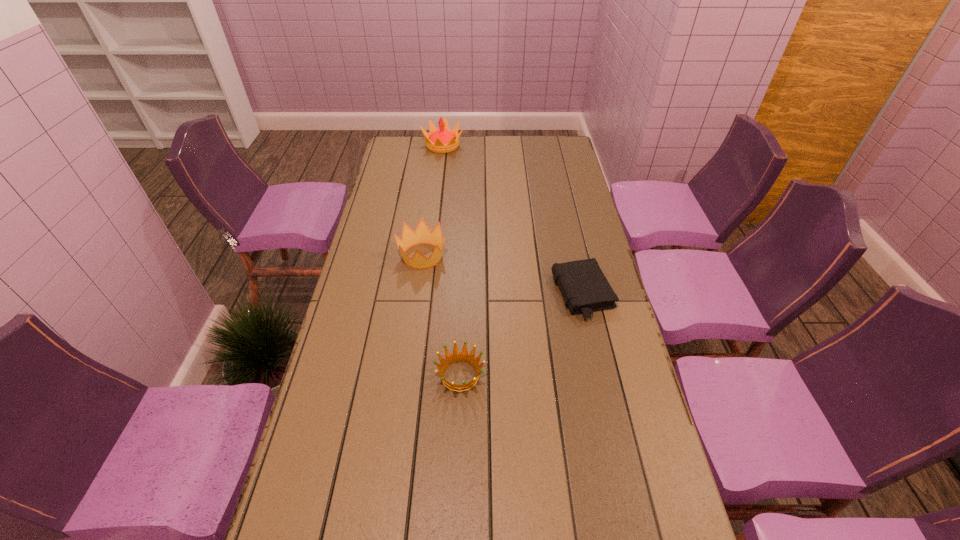
Identify the location of the tallest object. This screenshot has height=540, width=960. (444, 140).

Locate an element on the screen. the farthest crown is located at coordinates (444, 140).

Image resolution: width=960 pixels, height=540 pixels. I want to click on the second tallest crown, so click(x=422, y=235).

I want to click on the second tallest object, so click(422, 235).

Locate an element on the screen. the shortest crown is located at coordinates (456, 357).

At what (x,y) coordinates should I click in order to perform the action: click on the nearest crown. Please return your answer as a coordinate pair (x, y). The width and height of the screenshot is (960, 540). Looking at the image, I should click on (456, 357).

Where is `Bible`? Image resolution: width=960 pixels, height=540 pixels. Bible is located at coordinates (582, 283).

This screenshot has width=960, height=540. I want to click on the shortest object, so click(x=582, y=283).

Locate an element on the screen. This screenshot has height=540, width=960. vacant space located 0.260m on the right of the tallest object is located at coordinates click(x=518, y=145).

This screenshot has width=960, height=540. What are the coordinates of `vacant region located on the right of the second farthest crown` in the screenshot? It's located at (526, 256).